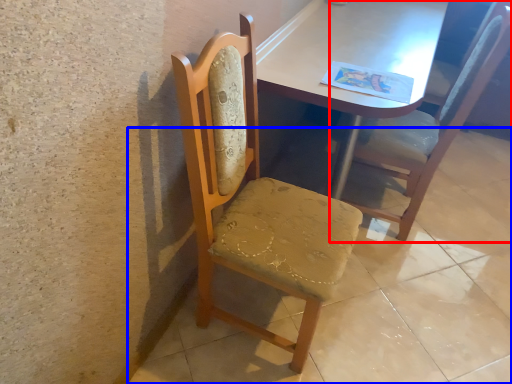
Question: Among these objects, which one is nearest to the camera, chair (highlighted by a red box) or concrete (highlighted by a blue box)?

Choices:
 (A) chair
 (B) concrete

Answer: (B)